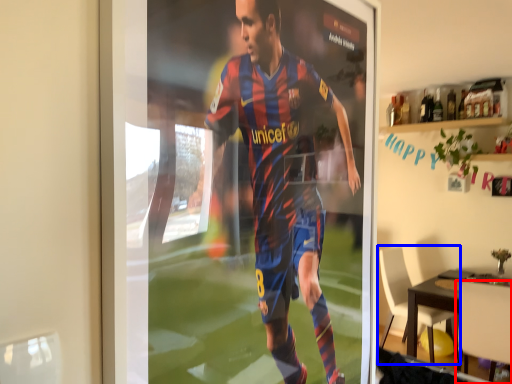
Question: Which of the following is the closest to the observer, chair (highlighted by a red box) or chair (highlighted by a blue box)?

Choices:
 (A) chair
 (B) chair

Answer: (A)